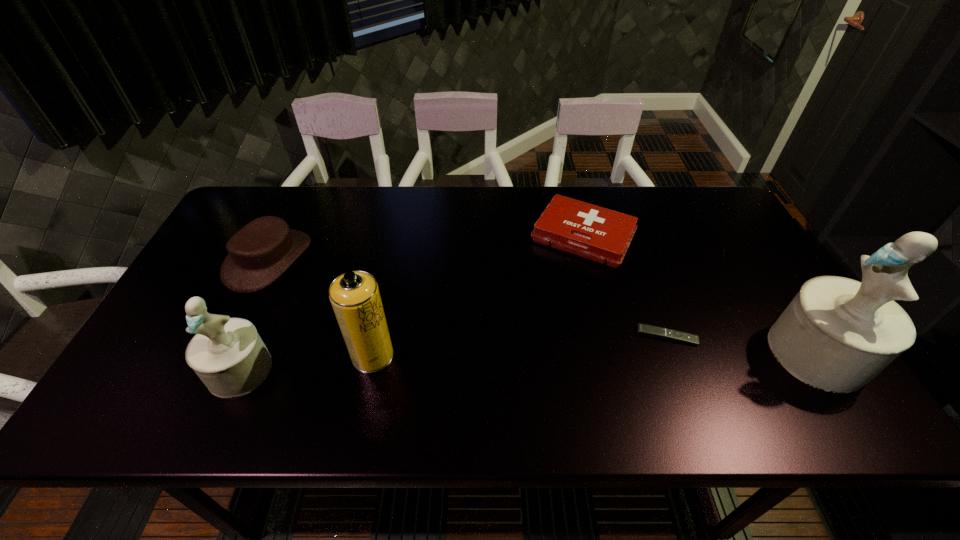
Identify the location of vacant space situated on the front of the fifth tallest object. (597, 291).

Identify the location of free region located on the right of the aerosol can. (448, 355).

The width and height of the screenshot is (960, 540). Identify the location of vacant space located 0.180m on the front of the hat. (225, 350).

This screenshot has width=960, height=540. I want to click on vacant space located on the left of the remote control, so click(x=478, y=336).

Where is `the first-aid kit present at the far edge`? the first-aid kit present at the far edge is located at coordinates (603, 235).

Where is `hat that is positioned at the far edge`? The image size is (960, 540). hat that is positioned at the far edge is located at coordinates (259, 253).

The width and height of the screenshot is (960, 540). Find the location of `aerosol can positioned at the near edge`. aerosol can positioned at the near edge is located at coordinates (355, 297).

You are a GUI agent. You are given a task and a screenshot of the screen. Output one action in this format:
    pyautogui.click(x=<x>, y=<y>)
    Task: Click on the object that is at the left edge
    The image size is (960, 540).
    Given the screenshot: What is the action you would take?
    pyautogui.click(x=259, y=253)

Find the location of `object present at the right edge`. object present at the right edge is located at coordinates (837, 334).

You are a GUI agent. You are given a task and a screenshot of the screen. Output one action in this format:
    pyautogui.click(x=<x>, y=<y>)
    Task: Click on the object that is at the far left corner
    This screenshot has width=960, height=540.
    Given the screenshot: What is the action you would take?
    pyautogui.click(x=259, y=253)